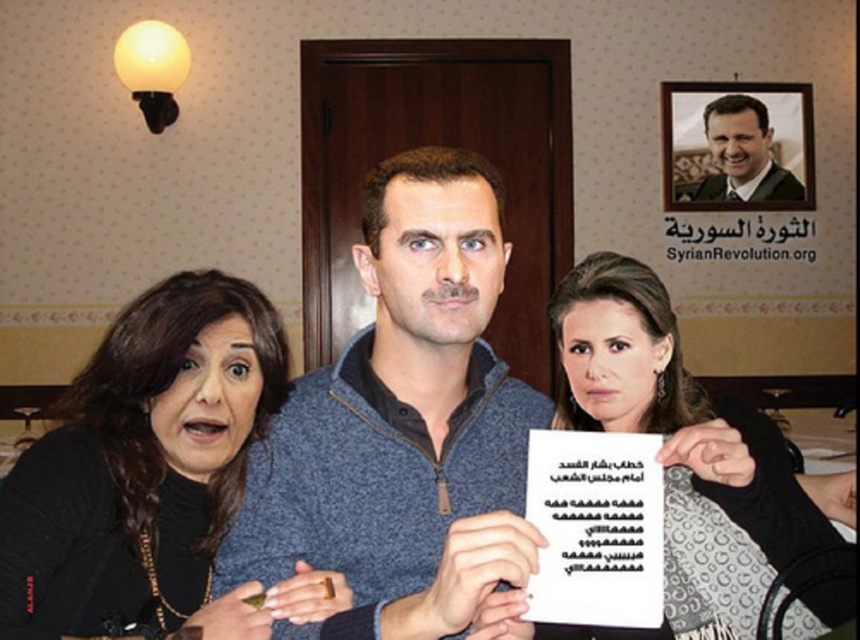
You are an interior designer planning to hang a decorative item in the room. The blue knitted sweater at center is currently occupying a spot at coordinate point (403, 426). If you want to place a new item 0.1 units to the right of this point, what coordinate would that be?

The new coordinate would be 0.766, 0.470 since adding 0.1 to the x coordinate of the blue knitted sweater at center at (403, 426) gives 0.766.

You are an observer in the room. You see the blue knitted sweater at center and the black matte hair at left. Which object is located to the right of the other?

The blue knitted sweater at center is positioned on the right side of black matte hair at left.